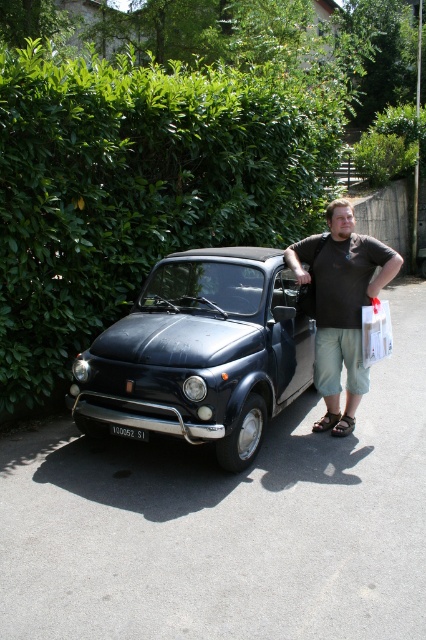
Question: Can you confirm if matte black shirt at center is positioned above white plastic license plate at center?

Choices:
 (A) yes
 (B) no

Answer: (A)

Question: Can you confirm if matte black shirt at center is bigger than white plastic license plate at center?

Choices:
 (A) no
 (B) yes

Answer: (B)

Question: Which of the following is the farthest from the observer?

Choices:
 (A) (236, 433)
 (B) (146, 83)

Answer: (B)

Question: Is green leafy hedge at upper left thinner than shiny black car at center?

Choices:
 (A) no
 (B) yes

Answer: (B)

Question: Which object is positioned closest to the white plastic license plate at center?

Choices:
 (A) white paper shopping bag at right
 (B) shiny black car at center
 (C) black rubber car at center

Answer: (B)

Question: Which is nearer to the white plastic license plate at center?

Choices:
 (A) white paper shopping bag at right
 (B) matte black shirt at center
 (C) green leafy hedge at upper left

Answer: (B)